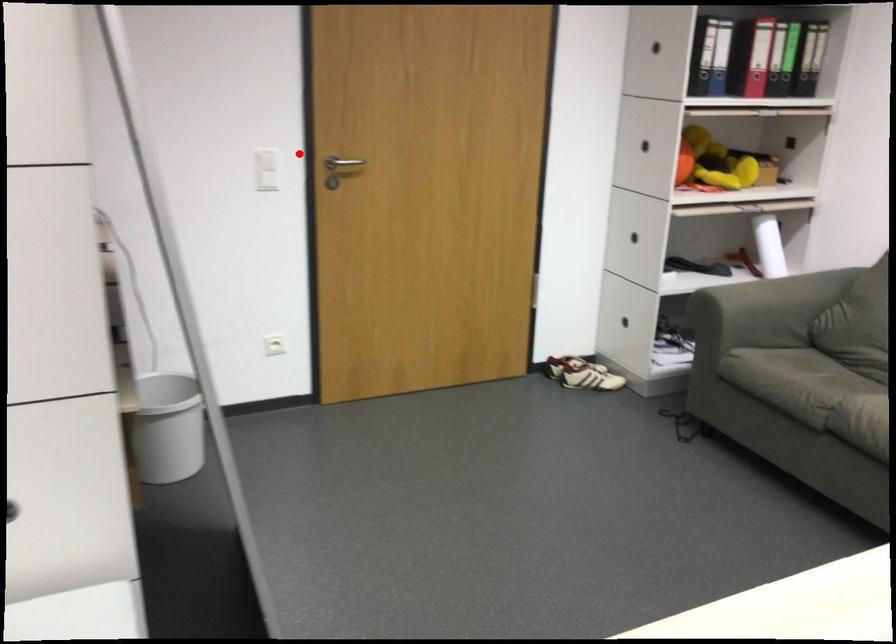
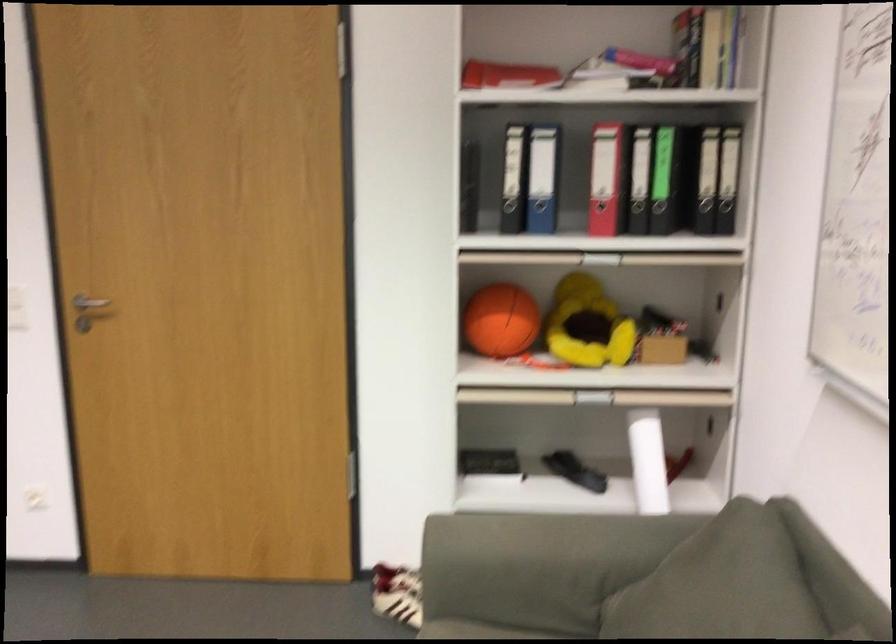
In the second image, find the point that corresponds to the highlighted location in the first image.

(88, 305)